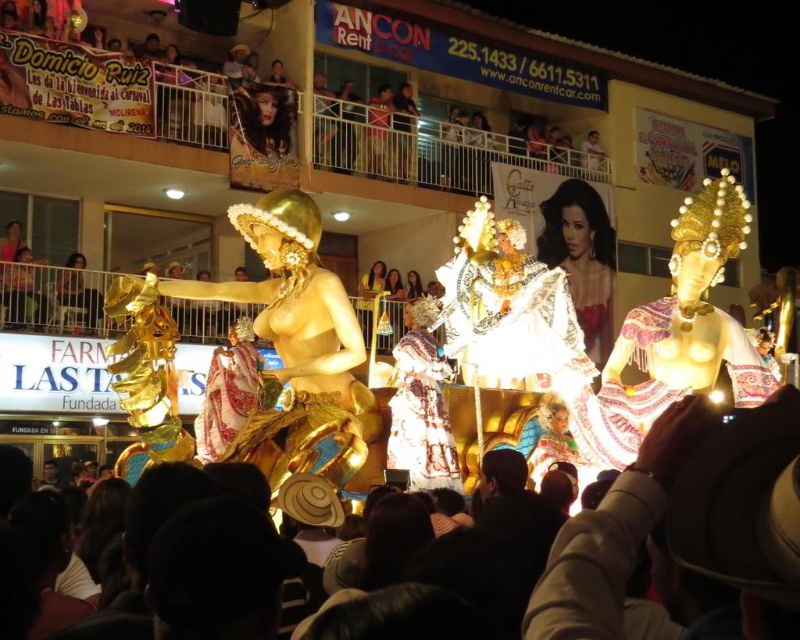
You are standing at the point labeled as point (410, 458) and want to walk towards the float. Is the point labeled as point (244, 204) located between you and the float?

Yes, the point labeled as point (244, 204) is in front of point (410, 458), so it is between you and the float.

You are a photographer at the carnival trying to capture the gold metallic statue at center and the gold metallic fabric at center in a single shot. Which object will appear larger in your photo?

The gold metallic statue at center will appear larger in your photo because it is closer to the viewer than the gold metallic fabric at center.

You are a photographer at the carnival and want to capture both the dark brown leather hat at lower center and the gold metallic statue at center in the same frame. Which object should you focus on first to ensure both are in the frame?

The dark brown leather hat at lower center is shorter than the gold metallic statue at center, so you should focus on the gold metallic statue at center first to ensure both are in the frame.